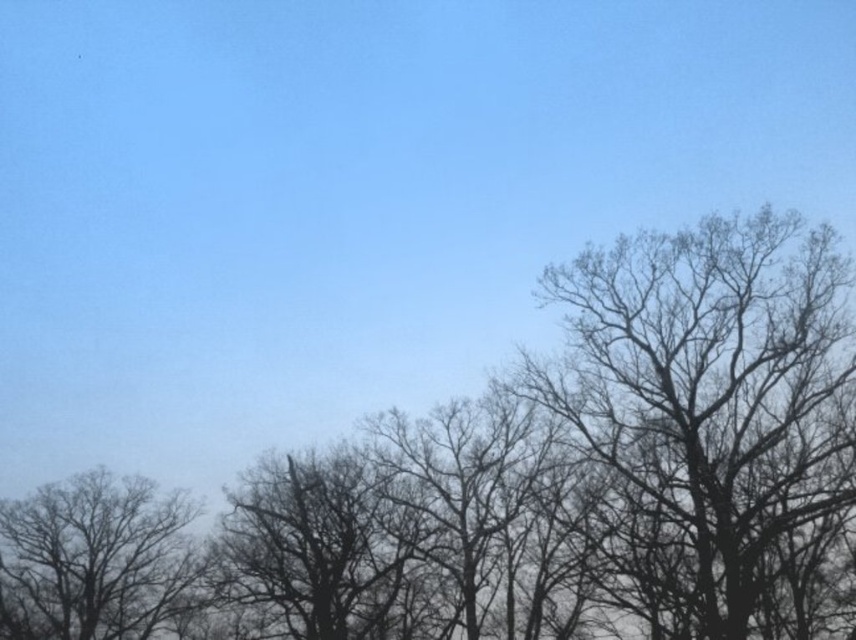
You are a bird looking for a place to perch. You see the bare branches at right in the image. Can you tell me the exact coordinates where you might find a suitable spot to land?

The bare branches at right are located at coordinates point (x=706, y=410), so you can land there.

You are an artist planning to paint this winter scene. The bare branches at right and the silhouette bare tree at left are important elements. Which of these two elements should you paint first if you want to create a sense of depth, considering their sizes?

The silhouette bare tree at left should be painted first because it is smaller and appears farther away, creating depth by placing smaller elements in the background.